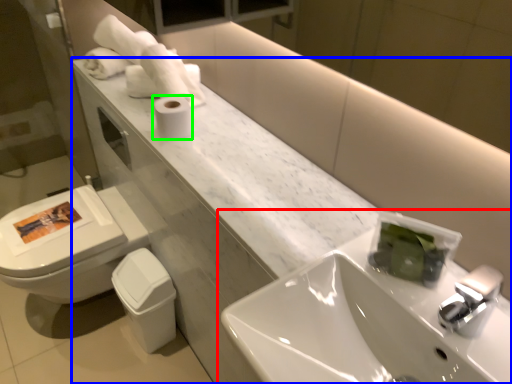
Question: Which object is positioned closest to sink (highlighted by a red box)? Select from counter (highlighted by a blue box) and toilet paper (highlighted by a green box).

Choices:
 (A) counter
 (B) toilet paper

Answer: (A)